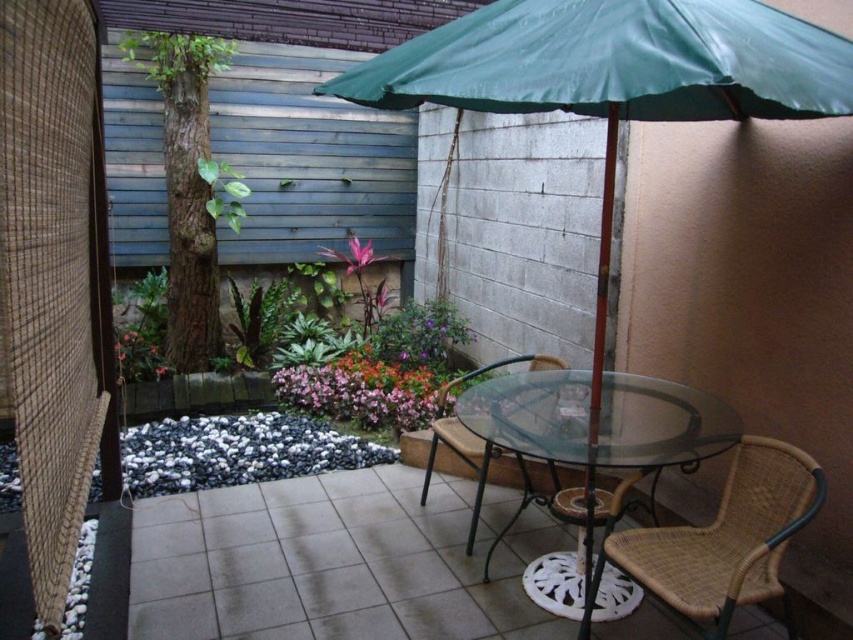
Question: Does purple matte plant at center appear under woven rattan chair at center?

Choices:
 (A) yes
 (B) no

Answer: (B)

Question: Does woven rattan chair at center have a lesser width compared to green glossy leaf at center?

Choices:
 (A) yes
 (B) no

Answer: (B)

Question: In this image, where is green leafy plant at upper left located relative to woven rattan chair at center?

Choices:
 (A) below
 (B) above

Answer: (B)

Question: Which point is farther to the camera?

Choices:
 (A) (624, 436)
 (B) (204, 172)

Answer: (B)

Question: Which is nearer to the green glossy leaf at center?

Choices:
 (A) green glossy leafy plant at center-left
 (B) green fabric umbrella at center
 (C) transparent glass table at center
 (D) woven rattan chair at lower right

Answer: (A)

Question: Which object is the farthest from the green leafy plant at upper left?

Choices:
 (A) woven rattan chair at center
 (B) vivid green leaves at center
 (C) green glossy leaf at center
 (D) green fabric umbrella at center

Answer: (D)